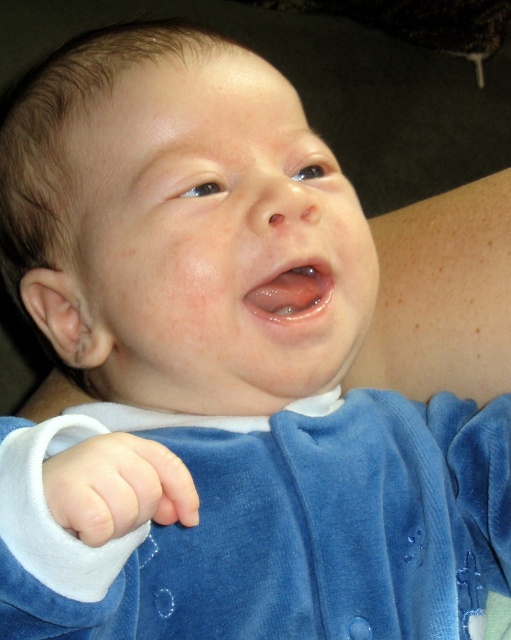
In the scene shown: Is velvet blue sleeve at lower left shorter than white soft hand at center?

Incorrect, velvet blue sleeve at lower left's height does not fall short of white soft hand at center's.

Is velvet blue sleeve at lower left positioned before white soft hand at center?

No.

Where is `velvet blue sleeve at lower left`? The width and height of the screenshot is (511, 640). velvet blue sleeve at lower left is located at coordinates (94, 560).

Is point (162, 435) behind point (58, 396)?

No, (162, 435) is closer to viewer.

Image resolution: width=511 pixels, height=640 pixels. Identify the location of velvet blue sleeve at lower left. (94, 560).

Describe the element at coordinates (118, 486) in the screenshot. The height and width of the screenshot is (640, 511). I see `white soft hand at center` at that location.

The width and height of the screenshot is (511, 640). Identify the location of white soft hand at center. [118, 486].

Find the location of a particular element. The width and height of the screenshot is (511, 640). white soft hand at center is located at coordinates (118, 486).